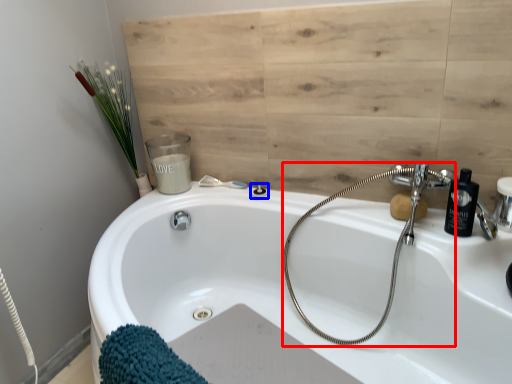
Question: Among these objects, which one is nearest to the camera, plumbing fixture (highlighted by a red box) or shower (highlighted by a blue box)?

Choices:
 (A) plumbing fixture
 (B) shower

Answer: (A)